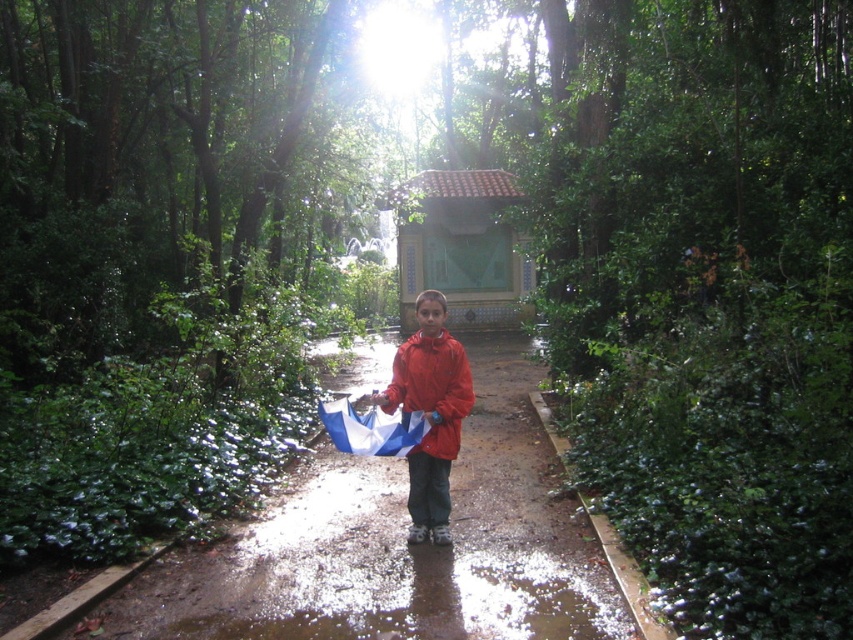
Question: Does brown tiled gazebo at center have a smaller size compared to red matte jacket at center?

Choices:
 (A) yes
 (B) no

Answer: (A)

Question: Is brown tiled gazebo at center bigger than matte red jacket at center?

Choices:
 (A) no
 (B) yes

Answer: (A)

Question: Is brown tiled gazebo at center to the right of red matte jacket at center from the viewer's perspective?

Choices:
 (A) yes
 (B) no

Answer: (A)

Question: Which of the following is the farthest from the observer?

Choices:
 (A) (374, 524)
 (B) (399, 378)
 (C) (407, 388)

Answer: (A)

Question: Considering the real-world distances, which object is farthest from the glossy concrete path at center?

Choices:
 (A) red matte jacket at center
 (B) matte red jacket at center

Answer: (A)

Question: Which object is positioned closest to the glossy concrete path at center?

Choices:
 (A) matte red jacket at center
 (B) brown tiled gazebo at center
 (C) red matte jacket at center

Answer: (A)